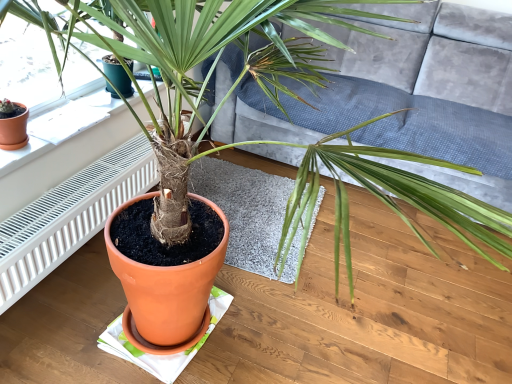
Question: Which is correct: gray soft rug at center is inside velvet grey couch at center, or outside of it?

Choices:
 (A) inside
 (B) outside

Answer: (B)

Question: In terms of height, does gray soft rug at center look taller or shorter compared to velvet grey couch at center?

Choices:
 (A) short
 (B) tall

Answer: (A)

Question: Which is farther from the gray soft rug at center?

Choices:
 (A) white textured radiator at left
 (B) white paper at upper left
 (C) velvet grey couch at center

Answer: (B)

Question: Which object is positioned closest to the gray soft rug at center?

Choices:
 (A) velvet grey couch at center
 (B) white textured radiator at left
 (C) white paper at upper left

Answer: (B)